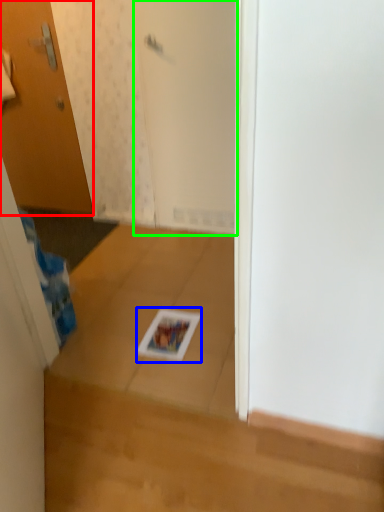
Question: Based on their relative distances, which object is nearer to door (highlighted by a red box)? Choose from magazine (highlighted by a blue box) and screen door (highlighted by a green box).

Choices:
 (A) magazine
 (B) screen door

Answer: (B)